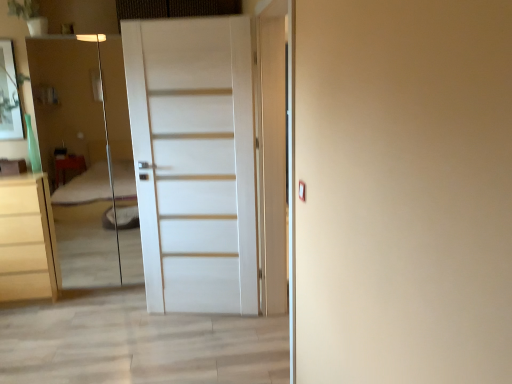
What is the approximate width of white matte door at center?

white matte door at center is 5.84 inches wide.

What do you see at coordinates (194, 161) in the screenshot?
I see `white matte door at center` at bounding box center [194, 161].

You are a GUI agent. You are given a task and a screenshot of the screen. Output one action in this format:
    pyautogui.click(x=<x>, y=<y>)
    Task: Click on the matte white chest of drawers at left
    
    Given the screenshot: What is the action you would take?
    pyautogui.click(x=27, y=240)

Image resolution: width=512 pixels, height=384 pixels. I want to click on white matte door at center, so click(194, 161).

In the image, there is a white matte door at center. Find the location of `elevator below it (from a real-world perspective)`. elevator below it (from a real-world perspective) is located at coordinates (76, 169).

Considering the relative sizes of white matte door at center and transparent glass elevator at left in the image provided, is white matte door at center wider than transparent glass elevator at left?

No.

From a real-world perspective, is white matte door at center above or below transparent glass elevator at left?

Clearly, from a real-world perspective, white matte door at center is above transparent glass elevator at left.

Relative to transparent glass elevator at left, is white matte door at center in front or behind?

white matte door at center is positioned closer to the viewer than transparent glass elevator at left.

Image resolution: width=512 pixels, height=384 pixels. In order to click on elevator lying in front of the matte white chest of drawers at left in this screenshot , I will do `click(76, 169)`.

From a real-world perspective, which is physically above, transparent glass elevator at left or matte white chest of drawers at left?

From a 3D spatial view, transparent glass elevator at left is above.

Could you tell me if transparent glass elevator at left is facing matte white chest of drawers at left?

No, transparent glass elevator at left is not facing towards matte white chest of drawers at left.

From the image's perspective, does transparent glass elevator at left appear lower than matte white chest of drawers at left?

No, from the image's perspective, transparent glass elevator at left is not below matte white chest of drawers at left.

Which object is further away from the camera, white matte door at center or matte white chest of drawers at left?

matte white chest of drawers at left.

From a real-world perspective, does white matte door at center stand above matte white chest of drawers at left?

Indeed, from a real-world perspective, white matte door at center stands above matte white chest of drawers at left.

Is white matte door at center aimed at matte white chest of drawers at left?

No, white matte door at center is not oriented towards matte white chest of drawers at left.

Can you confirm if white matte door at center is taller than matte white chest of drawers at left?

Indeed, white matte door at center has a greater height compared to matte white chest of drawers at left.

In the scene shown: Does matte white chest of drawers at left touch white matte door at center?

matte white chest of drawers at left and white matte door at center are clearly separated.

Does point (0, 190) appear closer or farther from the camera than point (253, 277)?

Clearly, point (0, 190) is more distant from the camera than point (253, 277).

Could you tell me if matte white chest of drawers at left is turned towards white matte door at center?

No, matte white chest of drawers at left is not turned towards white matte door at center.

Can you tell me how much matte white chest of drawers at left and white matte door at center differ in facing direction?

They differ by 13.6 degrees in their facing directions.

Locate an element on the screen. This screenshot has width=512, height=384. the chest of drawers that is behind the transparent glass elevator at left is located at coordinates (27, 240).

Can you tell me how much matte white chest of drawers at left and transparent glass elevator at left differ in facing direction?

The angular difference between matte white chest of drawers at left and transparent glass elevator at left is 0.804 degrees.

Looking at this image, which is correct: matte white chest of drawers at left is inside transparent glass elevator at left, or outside of it?

The correct answer is: outside.

From a real-world perspective, between matte white chest of drawers at left and transparent glass elevator at left, who is vertically higher?

transparent glass elevator at left, from a real-world perspective.

Which of these two, transparent glass elevator at left or white matte door at center, stands taller?

white matte door at center is taller.

Is transparent glass elevator at left located outside white matte door at center?

transparent glass elevator at left is positioned outside white matte door at center.

Can you tell me how much transparent glass elevator at left and white matte door at center differ in facing direction?

There is a 12.8-degree angle between the facing directions of transparent glass elevator at left and white matte door at center.

Looking at this image, is transparent glass elevator at left directly adjacent to white matte door at center?

They are not placed beside each other.

In order to click on elevator behind the white matte door at center in this screenshot , I will do `click(76, 169)`.

Identify the location of chest of drawers located on the left of transparent glass elevator at left. Image resolution: width=512 pixels, height=384 pixels. (27, 240).

In the scene shown: From the image, which object appears to be farther from matte white chest of drawers at left, transparent glass elevator at left or white matte door at center?

The object further to matte white chest of drawers at left is transparent glass elevator at left.

When comparing their distances from matte white chest of drawers at left, does white matte door at center or transparent glass elevator at left seem further?

transparent glass elevator at left lies further to matte white chest of drawers at left than the other object.

Consider the image. Considering their positions, is white matte door at center positioned closer to transparent glass elevator at left than matte white chest of drawers at left?

matte white chest of drawers at left.

When comparing their distances from white matte door at center, does transparent glass elevator at left or matte white chest of drawers at left seem closer?

matte white chest of drawers at left lies closer to white matte door at center than the other object.

Based on their spatial positions, is matte white chest of drawers at left or white matte door at center further from transparent glass elevator at left?

Among the two, white matte door at center is located further to transparent glass elevator at left.

Based on their spatial positions, is matte white chest of drawers at left or transparent glass elevator at left closer to white matte door at center?

Based on the image, matte white chest of drawers at left appears to be nearer to white matte door at center.

Find the location of `elevator between matte white chest of drawers at left and white matte door at center`. elevator between matte white chest of drawers at left and white matte door at center is located at coordinates (76, 169).